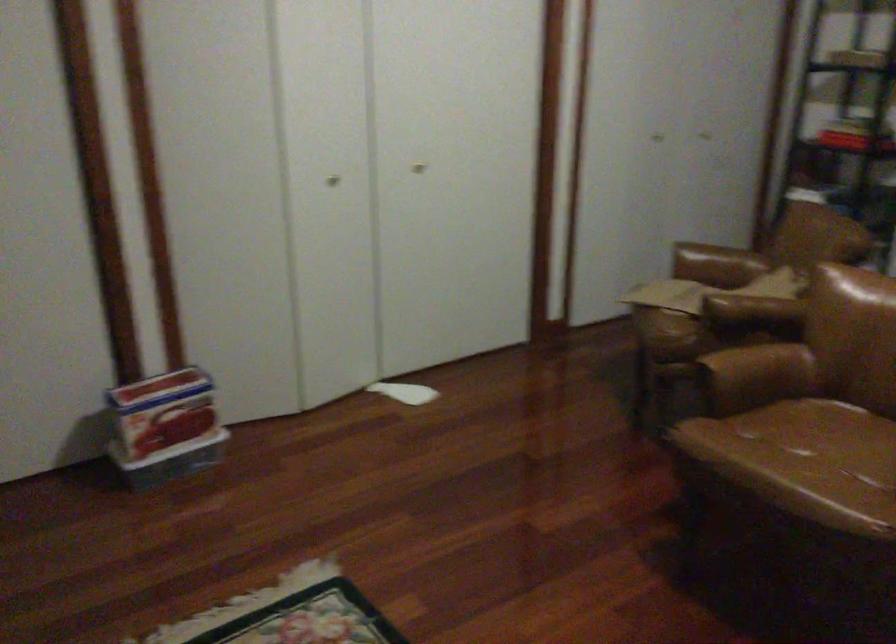
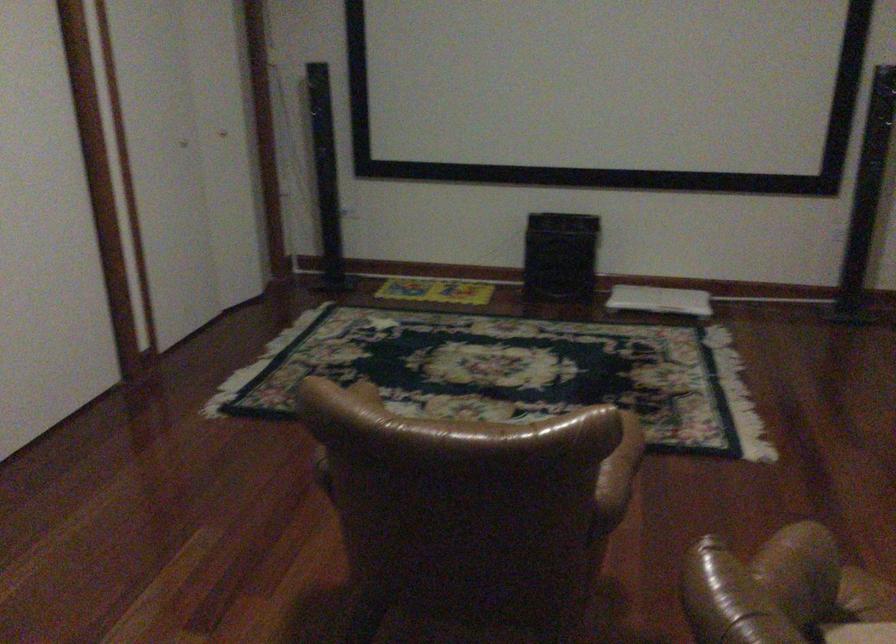
Find the pixel in the second image that matches (x=728, y=362) in the first image.

(622, 460)